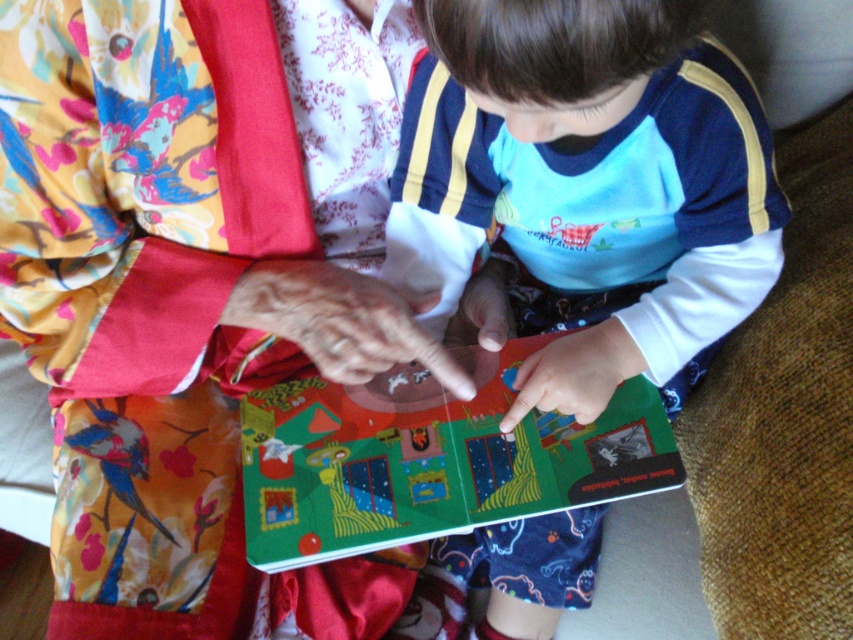
Question: Which point is farther to the camera?

Choices:
 (A) matte green book at center
 (B) floral silk kimono at center
 (C) matte paper book at center

Answer: (C)

Question: Among these points, which one is farthest from the camera?

Choices:
 (A) (26, 68)
 (B) (590, 440)

Answer: (B)

Question: Observing the image, what is the correct spatial positioning of matte green book at center in reference to matte paper book at center?

Choices:
 (A) below
 (B) above

Answer: (B)

Question: Which point is farther to the camera?

Choices:
 (A) (431, 394)
 (B) (61, 204)

Answer: (A)

Question: In this image, where is floral silk kimono at center located relative to matte green book at center?

Choices:
 (A) above
 (B) below

Answer: (B)

Question: Does matte green book at center lie behind matte paper book at center?

Choices:
 (A) no
 (B) yes

Answer: (A)